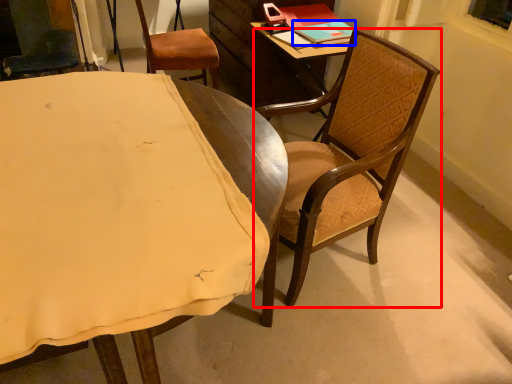
Question: Which of the following is the farthest to the observer, chair (highlighted by a red box) or book (highlighted by a blue box)?

Choices:
 (A) chair
 (B) book

Answer: (B)